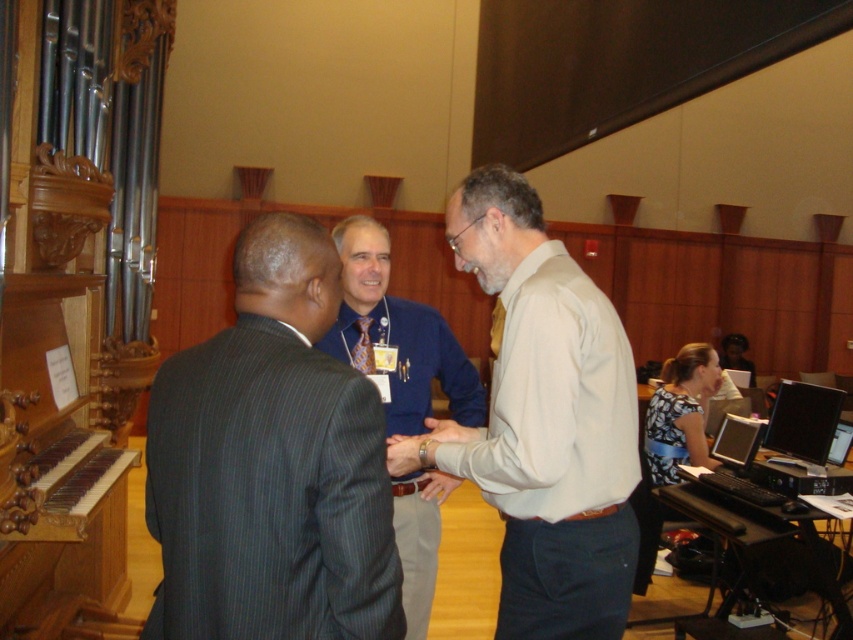
Which is above, dark gray pinstripe suit at center or blue shirt at center?

dark gray pinstripe suit at center is higher up.

In the scene shown: Is dark gray pinstripe suit at center smaller than blue shirt at center?

Indeed, dark gray pinstripe suit at center has a smaller size compared to blue shirt at center.

Which is behind, point (368, 531) or point (425, 387)?

Point (425, 387)

Where is `dark gray pinstripe suit at center`? dark gray pinstripe suit at center is located at coordinates (271, 465).

How far apart are light beige shirt at center and blue shirt at center?

The distance of light beige shirt at center from blue shirt at center is 12.44 inches.

Is light beige shirt at center bigger than blue shirt at center?

No, light beige shirt at center is not bigger than blue shirt at center.

This screenshot has width=853, height=640. I want to click on light beige shirt at center, so click(543, 422).

Between dark gray pinstripe suit at center and light beige shirt at center, which one has less height?

Standing shorter between the two is dark gray pinstripe suit at center.

Does dark gray pinstripe suit at center have a lesser width compared to light beige shirt at center?

Yes, dark gray pinstripe suit at center is thinner than light beige shirt at center.

This screenshot has height=640, width=853. I want to click on dark gray pinstripe suit at center, so click(271, 465).